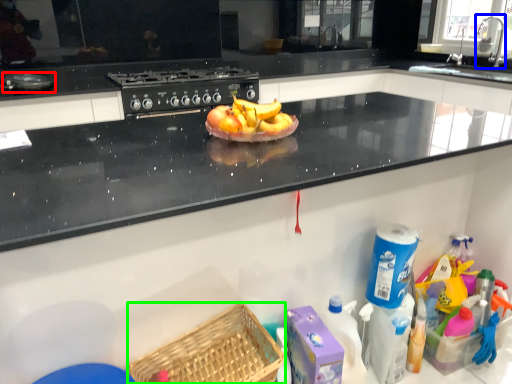
Question: Based on their relative distances, which object is farther from appliance (highlighted by a red box)? Choose from faucet (highlighted by a blue box) and basket (highlighted by a green box).

Choices:
 (A) faucet
 (B) basket

Answer: (A)